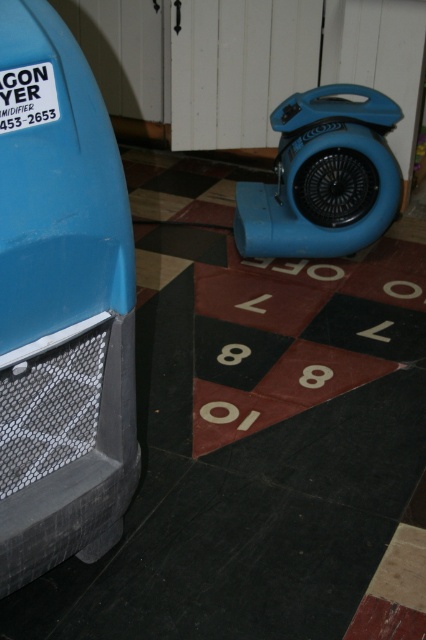
Which of these two, matte blue car at left or blue plastic fan at center right, stands taller?

matte blue car at left

Between matte blue car at left and blue plastic fan at center right, which one has less height?

blue plastic fan at center right

Locate an element on the screen. The width and height of the screenshot is (426, 640). matte blue car at left is located at coordinates (60, 305).

This screenshot has width=426, height=640. What are the coordinates of `matte blue car at left` in the screenshot? It's located at (60, 305).